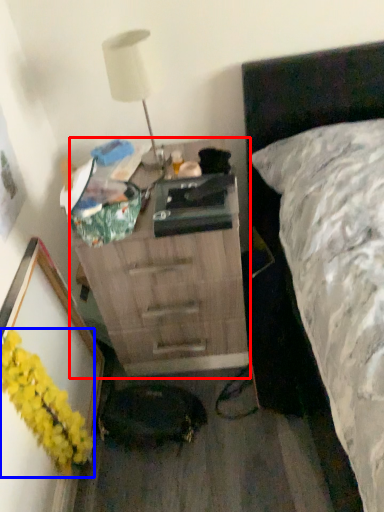
Question: Which object is closer to the camera taking this photo, chest of drawers (highlighted by a red box) or flower (highlighted by a blue box)?

Choices:
 (A) chest of drawers
 (B) flower

Answer: (B)